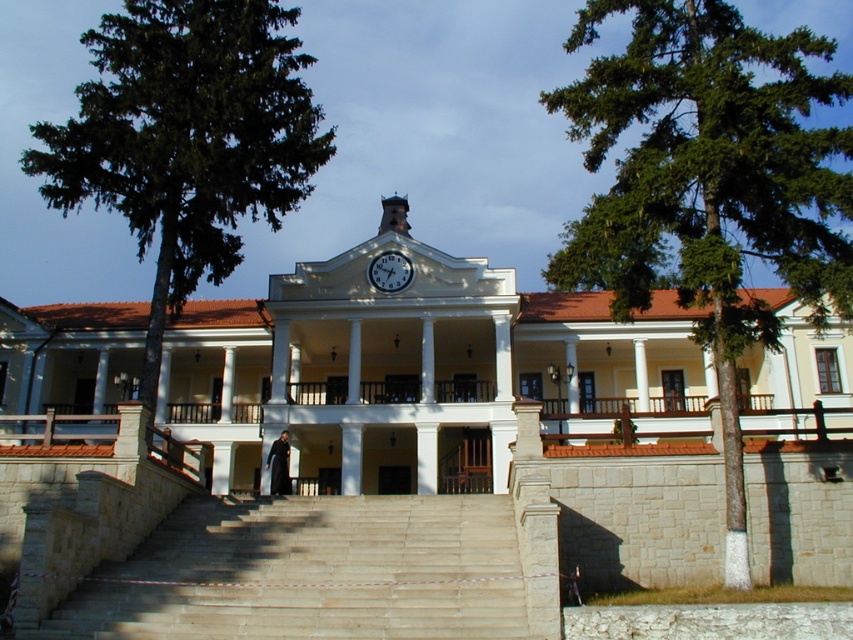
Question: Does green leafy tree at left come behind light beige stone stairs at center?

Choices:
 (A) yes
 (B) no

Answer: (A)

Question: Which point is farther to the camera?

Choices:
 (A) (186, 132)
 (B) (679, 88)

Answer: (A)

Question: Can you confirm if green leafy tree at center is wider than white glossy clock at center?

Choices:
 (A) yes
 (B) no

Answer: (A)

Question: Which point is farther from the camera taking this photo?

Choices:
 (A) (71, 170)
 (B) (643, 77)
 (C) (283, 586)
 (D) (386, 273)

Answer: (D)

Question: Is green leafy tree at center below light beige stone stairs at center?

Choices:
 (A) no
 (B) yes

Answer: (A)

Question: Estimate the real-world distances between objects in this image. Which object is farther from the green leafy tree at left?

Choices:
 (A) light beige stone stairs at center
 (B) white glossy clock at center
 (C) green leafy tree at center

Answer: (C)